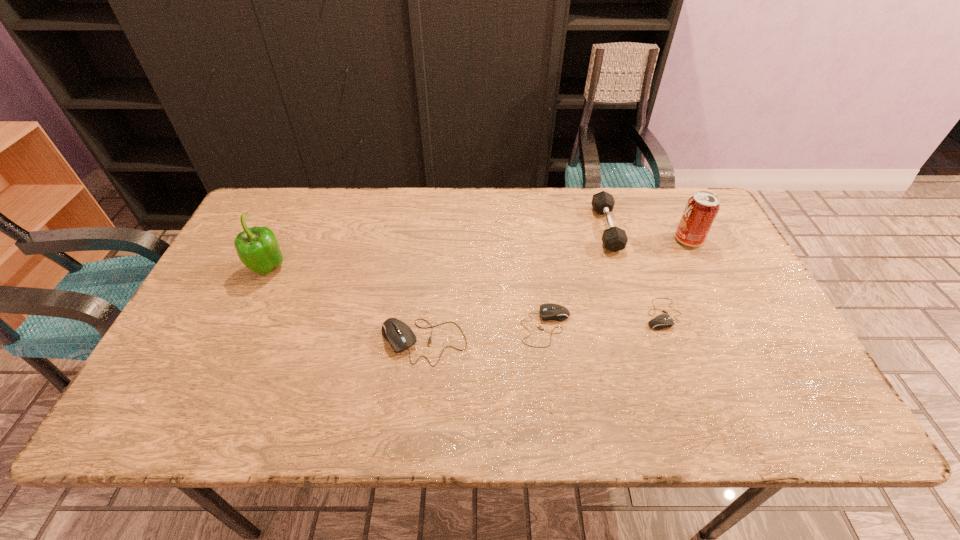
I want to click on object situated at the left edge, so click(257, 247).

Where is `object that is at the right edge`? This screenshot has width=960, height=540. object that is at the right edge is located at coordinates (700, 212).

Where is `object present at the far right corner`? object present at the far right corner is located at coordinates (700, 212).

The height and width of the screenshot is (540, 960). Identify the location of free space at the far edge. (534, 222).

In the image, there is a desktop. Where is `vacant space at the near edge`? vacant space at the near edge is located at coordinates (265, 377).

Image resolution: width=960 pixels, height=540 pixels. In the image, there is a desktop. In order to click on vacant space at the right edge in this screenshot , I will do `click(708, 244)`.

Locate an element on the screen. The width and height of the screenshot is (960, 540). free space at the near left corner of the desktop is located at coordinates (185, 360).

Find the location of a particular element. The image size is (960, 540). free space at the far right corner of the desktop is located at coordinates (696, 191).

Find the location of a particular element. This screenshot has width=960, height=540. vacant space in between the second computer mouse from right to left and the shortest computer mouse is located at coordinates (605, 321).

At what (x,y) coordinates should I click in order to perform the action: click on unoccupied position between the leftmost object and the leftmost computer mouse. Please return your answer as a coordinate pair (x, y). This screenshot has width=960, height=540. Looking at the image, I should click on (346, 306).